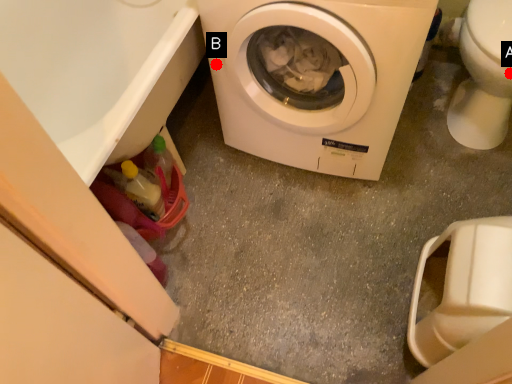
Question: Two points are circled on the image, labeled by A and B beside each circle. Among these points, which one is nearest to the camera?

Choices:
 (A) A is closer
 (B) B is closer

Answer: (A)